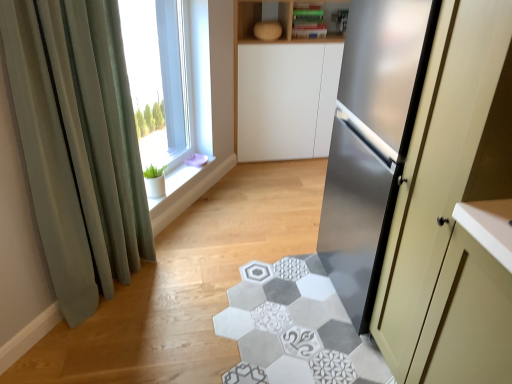
Image resolution: width=512 pixels, height=384 pixels. What do you see at coordinates (169, 82) in the screenshot?
I see `clear glass window at upper left` at bounding box center [169, 82].

Locate an element on the screen. The height and width of the screenshot is (384, 512). clear glass window at upper left is located at coordinates click(169, 82).

In order to click on satin silver refrigerator at right in this screenshot , I will do `click(446, 164)`.

Is clear glass window at upper left thinner than satin silver refrigerator at right?

Indeed, clear glass window at upper left has a lesser width compared to satin silver refrigerator at right.

Which of these two, clear glass window at upper left or satin silver refrigerator at right, is bigger?

satin silver refrigerator at right.

From a real-world perspective, is clear glass window at upper left positioned above or below satin silver refrigerator at right?

In terms of real-world spatial position, clear glass window at upper left is above satin silver refrigerator at right.

Is point (159, 143) farther from viewer compared to point (166, 186)?

Yes, point (159, 143) is farther from viewer.

Does clear glass window at upper left have a greater height compared to white ceramic window sill at upper left?

Correct, clear glass window at upper left is much taller as white ceramic window sill at upper left.

From the image's perspective, which is above, clear glass window at upper left or white ceramic window sill at upper left?

clear glass window at upper left, from the image's perspective.

What's the angular difference between clear glass window at upper left and white ceramic window sill at upper left's facing directions?

The angle between the facing direction of clear glass window at upper left and the facing direction of white ceramic window sill at upper left is 0.00126 degrees.

From the image's perspective, which object appears higher, green fabric curtain at left or white ceramic window sill at upper left?

green fabric curtain at left.

Looking at this image, can you tell me how much green fabric curtain at left and white ceramic window sill at upper left differ in facing direction?

green fabric curtain at left and white ceramic window sill at upper left are facing 1.8 degrees away from each other.

In the scene shown: From their relative heights in the image, would you say green fabric curtain at left is taller or shorter than white ceramic window sill at upper left?

Clearly, green fabric curtain at left is taller compared to white ceramic window sill at upper left.

Is green fabric curtain at left thinner than white ceramic window sill at upper left?

Yes, green fabric curtain at left is thinner than white ceramic window sill at upper left.

Is clear glass window at upper left situated inside green fabric curtain at left or outside?

clear glass window at upper left is located beyond the bounds of green fabric curtain at left.

From a real-world perspective, is clear glass window at upper left positioned under green fabric curtain at left based on gravity?

No.

Looking at this image, visually, is clear glass window at upper left positioned to the left or to the right of green fabric curtain at left?

clear glass window at upper left is positioned on green fabric curtain at left's right side.

Can you confirm if clear glass window at upper left is bigger than green fabric curtain at left?

No, clear glass window at upper left is not bigger than green fabric curtain at left.

From the image's perspective, which is above, green fabric curtain at left or satin silver refrigerator at right?

green fabric curtain at left, from the image's perspective.

Does green fabric curtain at left turn towards satin silver refrigerator at right?

Yes, green fabric curtain at left is aimed at satin silver refrigerator at right.

Does green fabric curtain at left have a lesser width compared to satin silver refrigerator at right?

Yes.

Considering the positions of point (187, 169) and point (413, 216), is point (187, 169) closer or farther from the camera than point (413, 216)?

Point (187, 169) appears to be farther away from the viewer than point (413, 216).

Is white ceramic window sill at upper left placed right next to satin silver refrigerator at right?

No, white ceramic window sill at upper left is not in contact with satin silver refrigerator at right.

Who is more distant, white ceramic window sill at upper left or satin silver refrigerator at right?

white ceramic window sill at upper left is behind.

Consider the image. Can you confirm if satin silver refrigerator at right is wider than white ceramic window sill at upper left?

Indeed, satin silver refrigerator at right has a greater width compared to white ceramic window sill at upper left.

Is satin silver refrigerator at right turned away from white ceramic window sill at upper left?

No, satin silver refrigerator at right is not facing the opposite direction of white ceramic window sill at upper left.

I want to click on window sill behind the satin silver refrigerator at right, so click(175, 182).

Does satin silver refrigerator at right appear on the right side of white ceramic window sill at upper left?

Correct, you'll find satin silver refrigerator at right to the right of white ceramic window sill at upper left.

Image resolution: width=512 pixels, height=384 pixels. Identify the location of window above the satin silver refrigerator at right (from the image's perspective). (169, 82).

Locate an element on the screen. window sill on the right of clear glass window at upper left is located at coordinates [x=175, y=182].

Estimate the real-world distances between objects in this image. Which object is closer to green fabric curtain at left, clear glass window at upper left or satin silver refrigerator at right?

Among the two, clear glass window at upper left is located nearer to green fabric curtain at left.

Based on their spatial positions, is white ceramic window sill at upper left or satin silver refrigerator at right closer to clear glass window at upper left?

Among the two, white ceramic window sill at upper left is located nearer to clear glass window at upper left.

Estimate the real-world distances between objects in this image. Which object is closer to green fabric curtain at left, white ceramic window sill at upper left or satin silver refrigerator at right?

The object closer to green fabric curtain at left is white ceramic window sill at upper left.

When comparing their distances from clear glass window at upper left, does green fabric curtain at left or white ceramic window sill at upper left seem further?

Based on the image, green fabric curtain at left appears to be further to clear glass window at upper left.

Looking at the image, which one is located further to satin silver refrigerator at right, green fabric curtain at left or white ceramic window sill at upper left?

white ceramic window sill at upper left.

Which object lies nearer to the anchor point white ceramic window sill at upper left, clear glass window at upper left or green fabric curtain at left?

clear glass window at upper left is closer to white ceramic window sill at upper left.

Considering their positions, is white ceramic window sill at upper left positioned closer to satin silver refrigerator at right than green fabric curtain at left?

Among the two, green fabric curtain at left is located nearer to satin silver refrigerator at right.

Estimate the real-world distances between objects in this image. Which object is closer to satin silver refrigerator at right, white ceramic window sill at upper left or clear glass window at upper left?

white ceramic window sill at upper left is positioned closer to the anchor satin silver refrigerator at right.

Identify the location of curtain between satin silver refrigerator at right and white ceramic window sill at upper left along the z-axis. The image size is (512, 384). (78, 144).

At what (x,y) coordinates should I click in order to perform the action: click on window positioned between satin silver refrigerator at right and white ceramic window sill at upper left from near to far. Please return your answer as a coordinate pair (x, y). Looking at the image, I should click on (169, 82).

I want to click on window situated between green fabric curtain at left and satin silver refrigerator at right from left to right, so point(169,82).

Locate an element on the screen. window between green fabric curtain at left and white ceramic window sill at upper left from front to back is located at coordinates click(x=169, y=82).